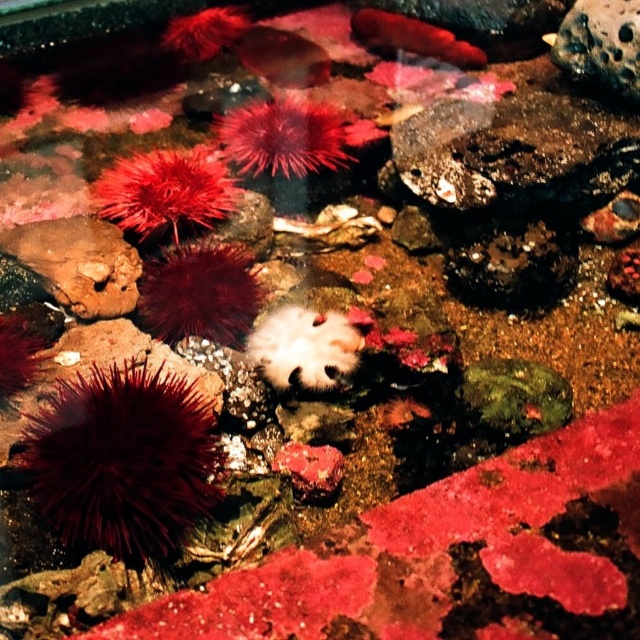
Question: Can you confirm if brown rough rock at left is positioned below white fuzzy sea anemone at center?

Choices:
 (A) yes
 (B) no

Answer: (B)

Question: Which object is farther from the camera taking this photo?

Choices:
 (A) fuzzy red sea urchin at upper center
 (B) white fuzzy sea anemone at center
 (C) red spiky sea urchin at center
 (D) dark red spiky sea urchin at lower left

Answer: (A)

Question: Is dark red spiky sea urchin at lower left wider than brown rough rock at left?

Choices:
 (A) yes
 (B) no

Answer: (A)

Question: Does brown rough rock at left have a larger size compared to white fuzzy sea anemone at center?

Choices:
 (A) no
 (B) yes

Answer: (B)

Question: Which of the following is the farthest from the observer?

Choices:
 (A) (333, 156)
 (B) (321, 346)
 (C) (136, 552)
 (D) (35, 252)

Answer: (A)

Question: Estimate the real-world distances between objects in this image. Which object is closer to the white fuzzy sea anemone at center?

Choices:
 (A) fuzzy red sea urchin at upper center
 (B) red spiky sea urchin at center
 (C) brown rough rock at left
 (D) dark red spiky sea urchin at lower left

Answer: (D)